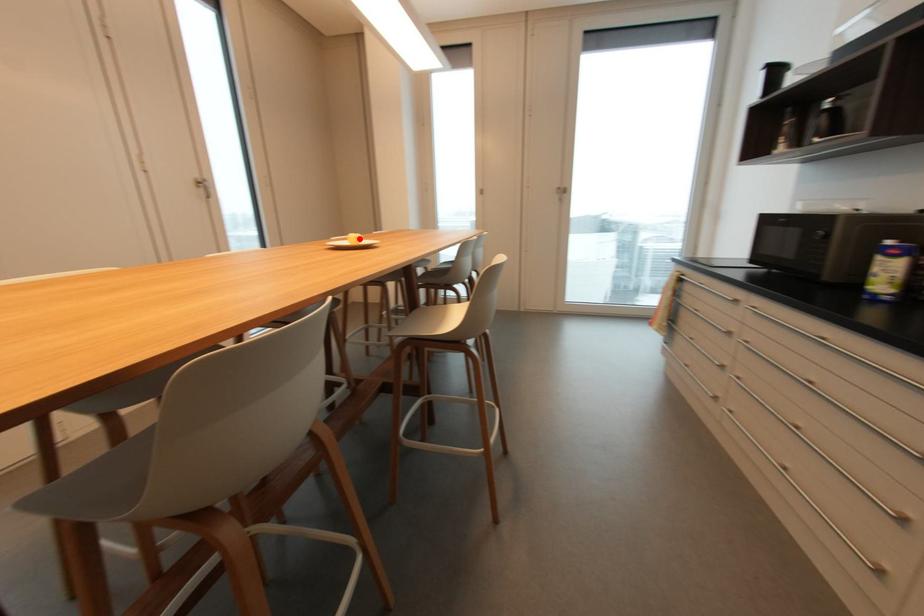
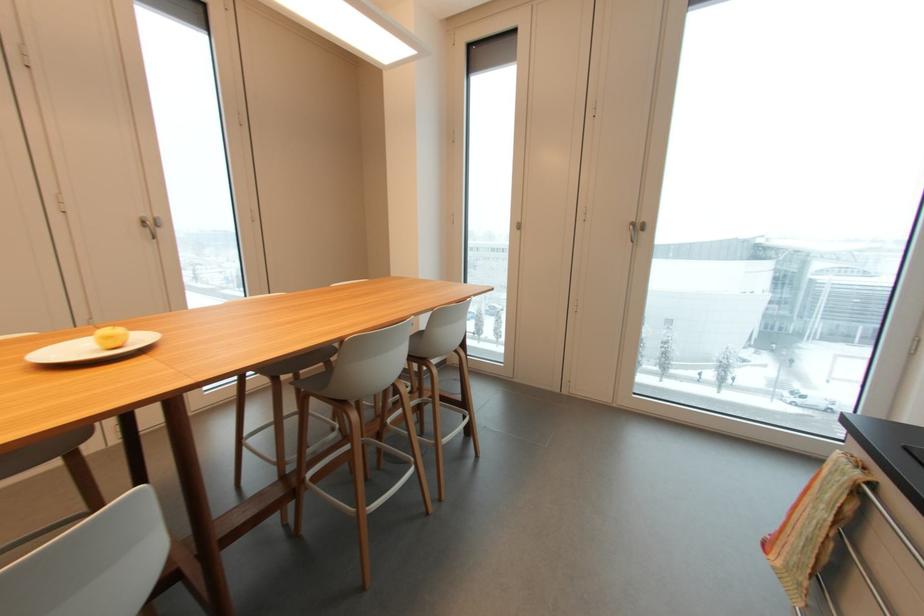
The point at the highlighted location is marked in the first image. Where is the corresponding point in the second image?

(110, 338)